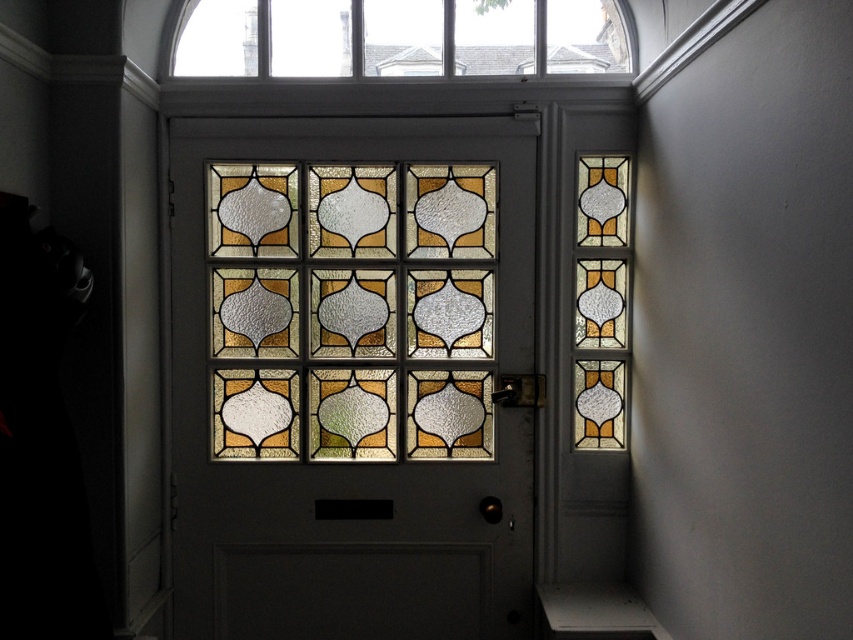
Is point (273, 563) in front of point (315, 381)?

That is True.

Looking at this image, between stained glass window at center and translucent stained glass at center, which one appears on the right side from the viewer's perspective?

translucent stained glass at center

The image size is (853, 640). Find the location of `stained glass window at center`. stained glass window at center is located at coordinates (350, 376).

Is translucent stained glass at center further to the viewer compared to clear glass window at upper center?

No, translucent stained glass at center is in front of clear glass window at upper center.

Between point (392, 300) and point (614, 40), which one is positioned behind?

Point (392, 300)

Locate an element on the screen. The image size is (853, 640). translucent stained glass at center is located at coordinates (352, 310).

Is stained glass window at center closer to the viewer compared to clear glass window at upper center?

That is True.

Consider the image. Is stained glass window at center smaller than clear glass window at upper center?

No.

Where is `stained glass window at center`? The height and width of the screenshot is (640, 853). stained glass window at center is located at coordinates (350, 376).